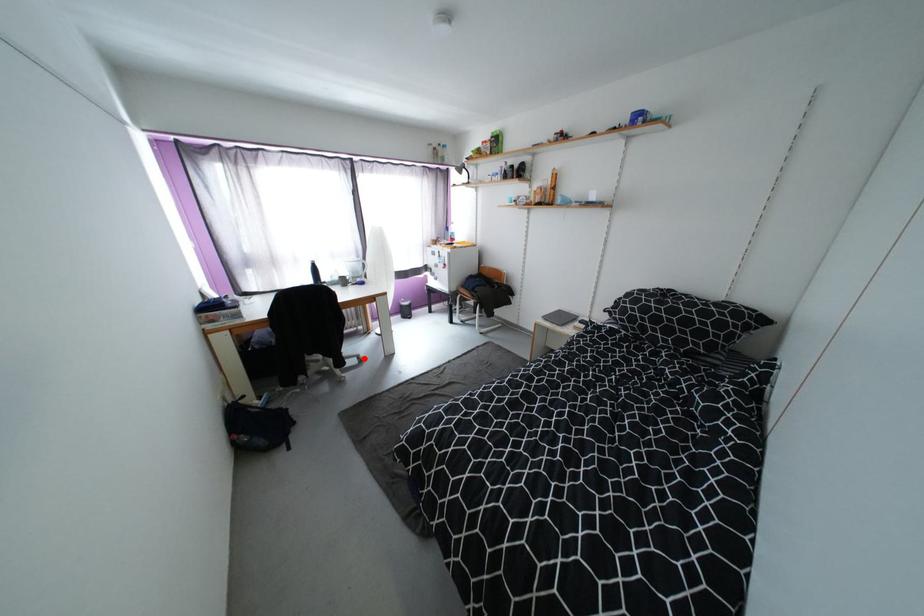
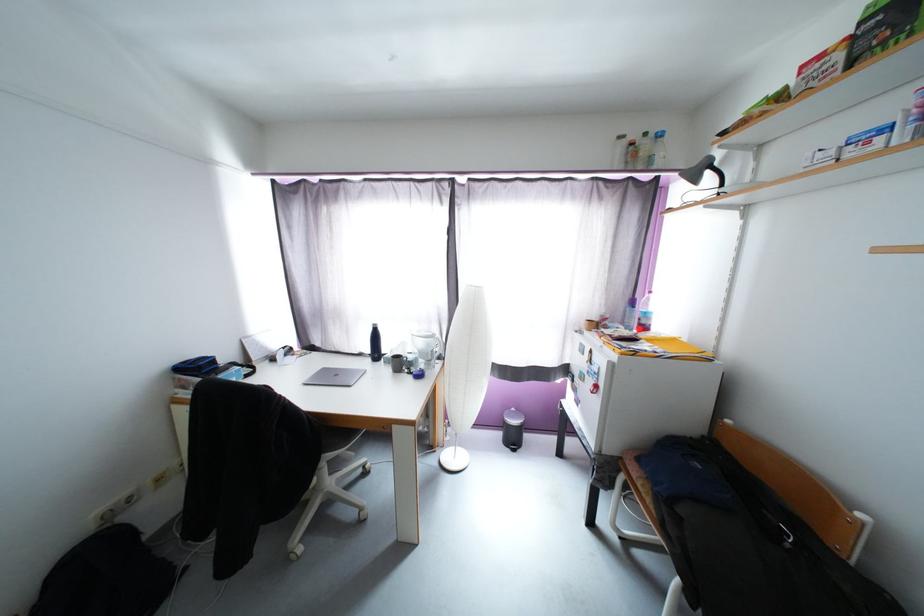
Question: I am providing you with two images of the same scene from different viewpoints. In image1, a red point is highlighted. Considering the same 3D point in image2, which of the following is correct?

Choices:
 (A) It is closer
 (B) It is farther

Answer: (A)